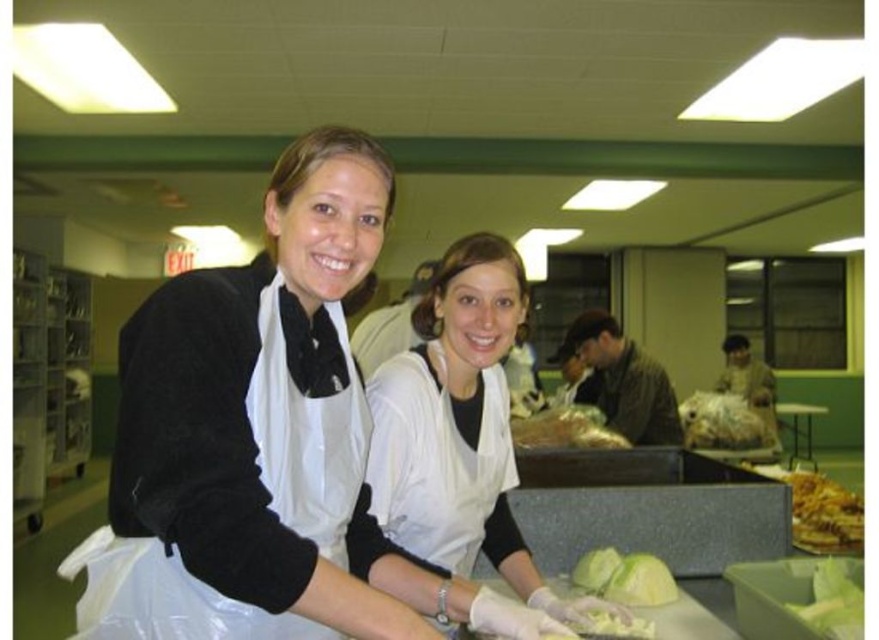
Is point (825, 481) positioned behind point (549, 408)?

No.

Does golden crispy fries at lower right have a greater width compared to translucent plastic bag at center?

Yes, golden crispy fries at lower right is wider than translucent plastic bag at center.

Measure the distance between golden crispy fries at lower right and camera.

6.05 feet

Identify the location of golden crispy fries at lower right. This screenshot has width=879, height=640. (825, 515).

You are a GUI agent. You are given a task and a screenshot of the screen. Output one action in this format:
    pyautogui.click(x=<x>, y=<y>)
    Task: Click on the black matte apron at center
    Image resolution: width=879 pixels, height=640 pixels.
    Given the screenshot: What is the action you would take?
    pyautogui.click(x=265, y=408)

Is point (237, 330) in front of point (796, 492)?

Yes, it is.

This screenshot has height=640, width=879. What do you see at coordinates (265, 408) in the screenshot? I see `black matte apron at center` at bounding box center [265, 408].

The width and height of the screenshot is (879, 640). What are the coordinates of `black matte apron at center` in the screenshot? It's located at (265, 408).

Where is `golden crispy fries at lower right`? This screenshot has height=640, width=879. golden crispy fries at lower right is located at coordinates (825, 515).

Can you confirm if golden crispy fries at lower right is shorter than green leafy vegetable at lower right?

Incorrect, golden crispy fries at lower right's height does not fall short of green leafy vegetable at lower right's.

Does point (855, 500) come farther from viewer compared to point (821, 570)?

Yes, point (855, 500) is farther from viewer.

Where is `golden crispy fries at lower right`? This screenshot has width=879, height=640. golden crispy fries at lower right is located at coordinates (825, 515).